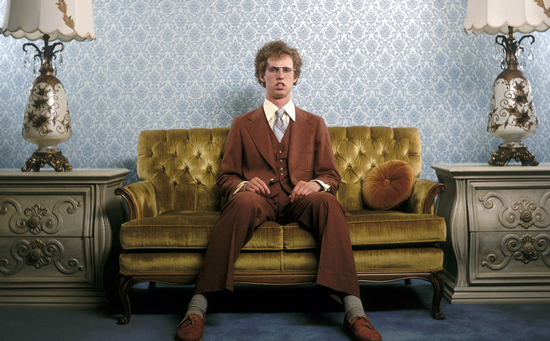
This screenshot has width=550, height=341. What are the coordinates of `lamp` in the screenshot? It's located at (57, 149), (502, 114).